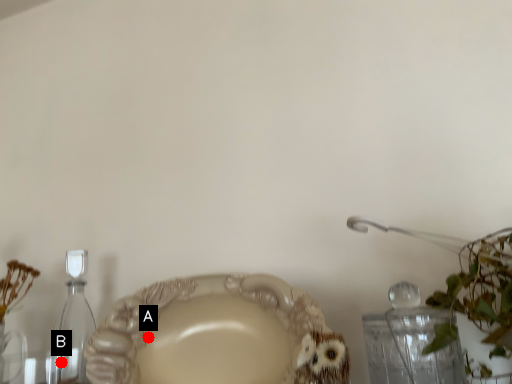
Question: Two points are circled on the image, labeled by A and B beside each circle. Which of the following is the farthest from the observer?

Choices:
 (A) A is further
 (B) B is further

Answer: (A)